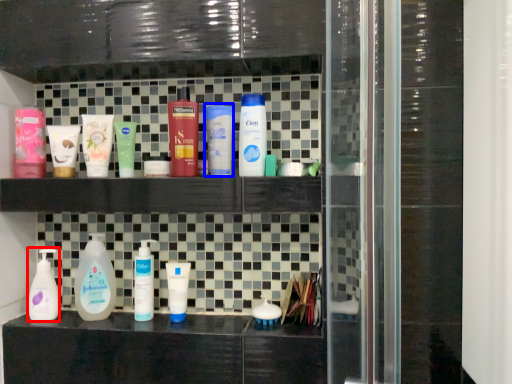
Question: Which object appears closest to the camera in this image, cleaning product (highlighted by a red box) or toiletry (highlighted by a blue box)?

Choices:
 (A) cleaning product
 (B) toiletry

Answer: (B)